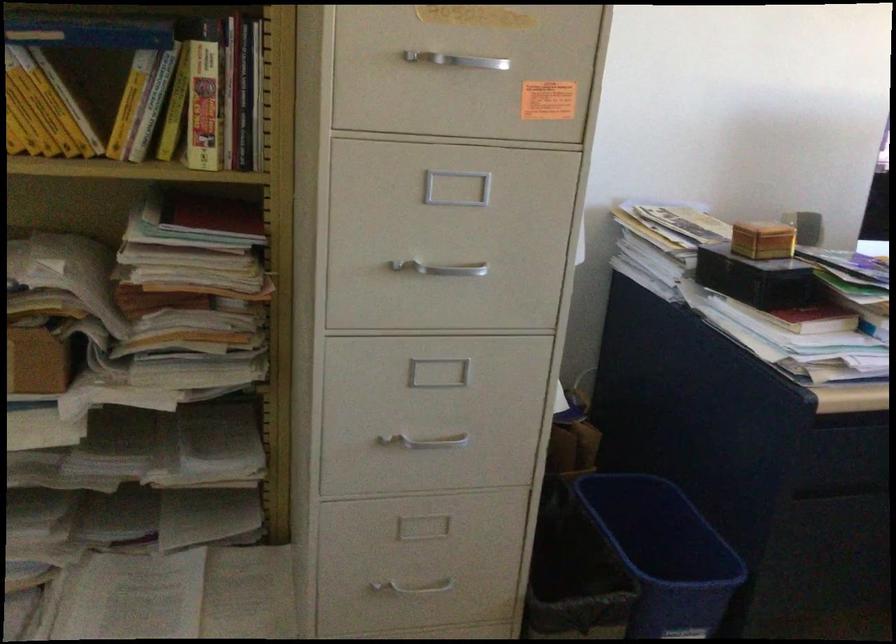
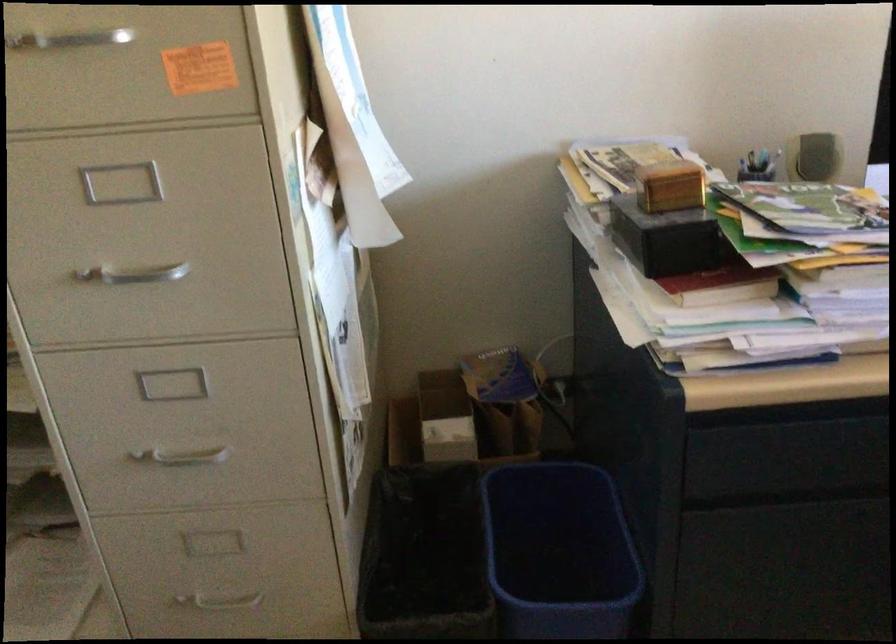
Find the pixel in the second image that matches (x=417, y=438) in the first image.

(181, 456)